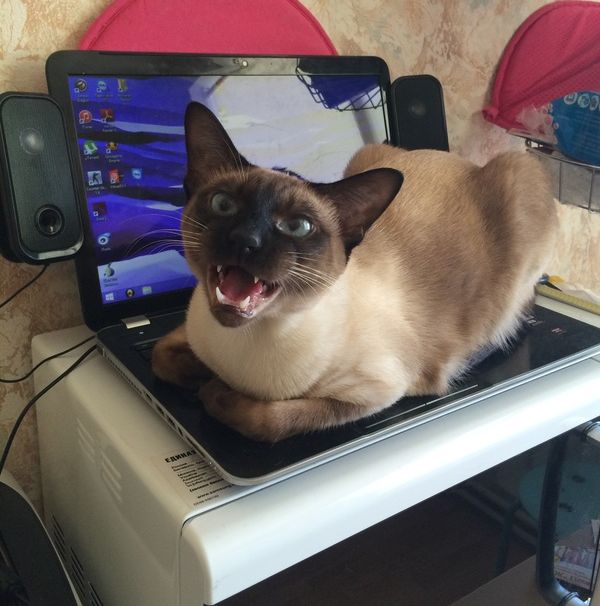
This screenshot has width=600, height=606. I want to click on speaker, so click(50, 171).